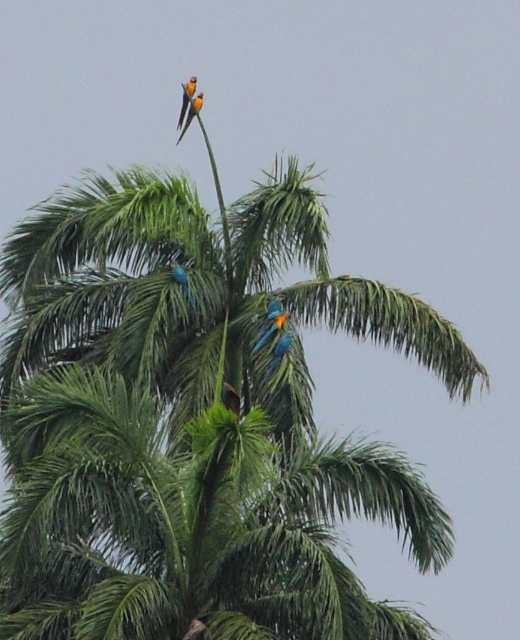
Question: Considering the real-world distances, which object is closest to the green leafy coconut tree at upper center?

Choices:
 (A) shiny orange bird at upper center
 (B) blue glossy parrot at center
 (C) blue-green feathers at top

Answer: (B)

Question: Based on their relative distances, which object is nearer to the shiny blue parrot at center?

Choices:
 (A) blue-green feathers at top
 (B) green leafy coconut tree at upper center

Answer: (B)

Question: Is green leafy coconut tree at upper center to the left of shiny orange bird at upper center from the viewer's perspective?

Choices:
 (A) yes
 (B) no

Answer: (B)

Question: Based on their relative distances, which object is farther from the shiny blue parrot at center?

Choices:
 (A) blue-green feathers at top
 (B) green leafy coconut tree at upper center
 (C) shiny orange bird at upper center
 (D) blue glossy parrot at center

Answer: (C)

Question: Does green leafy coconut tree at upper center have a lesser width compared to shiny orange bird at upper center?

Choices:
 (A) no
 (B) yes

Answer: (A)

Question: Is shiny blue parrot at center further to the viewer compared to blue glossy parrot at center?

Choices:
 (A) yes
 (B) no

Answer: (A)